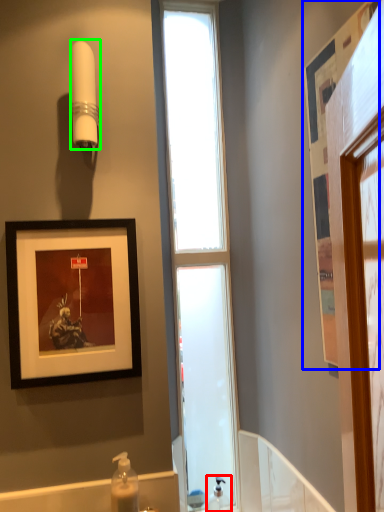
Question: Which is farther away from soap dispenser (highlighted by a red box)? picture frame (highlighted by a blue box) or shower (highlighted by a green box)?

Choices:
 (A) picture frame
 (B) shower

Answer: (B)